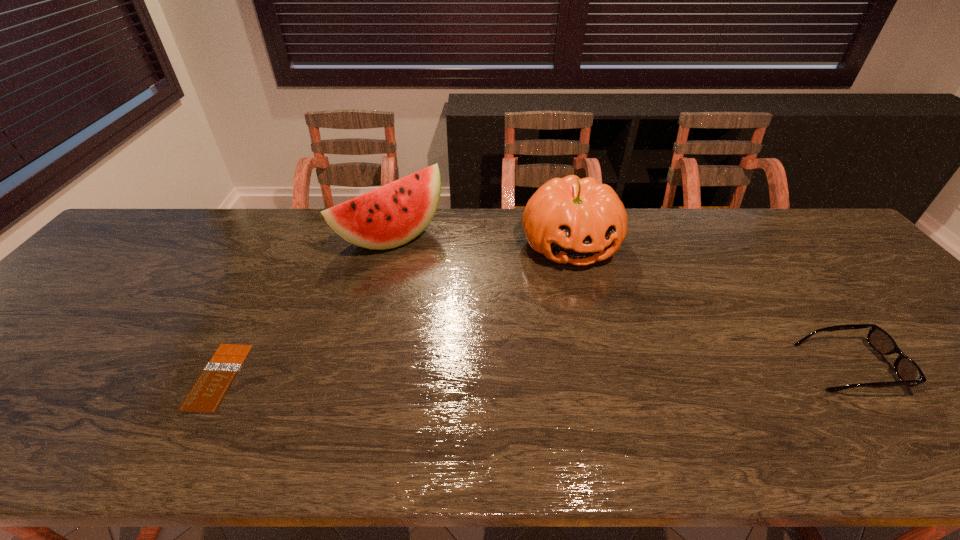
You are a GUI agent. You are given a task and a screenshot of the screen. Output one action in this format:
    pyautogui.click(x=<x>, y=<y>)
    Task: Click on the vacant space at the left edge of the desktop
    The width and height of the screenshot is (960, 540).
    Given the screenshot: What is the action you would take?
    17,338

In the image, there is a desktop. Where is `vacant space at the far left corner`? This screenshot has width=960, height=540. vacant space at the far left corner is located at coordinates (165, 224).

Locate an element on the screen. This screenshot has width=960, height=540. vacant space at the far right corner is located at coordinates (845, 244).

The image size is (960, 540). I want to click on blank region between the second object from right to left and the second shortest object, so 709,306.

This screenshot has height=540, width=960. Find the location of `free space between the pumpkin and the third object from right to left`. free space between the pumpkin and the third object from right to left is located at coordinates (481, 240).

What are the coordinates of `free space between the second object from left to right and the spectacles` in the screenshot? It's located at (620, 302).

This screenshot has width=960, height=540. What are the coordinates of `vacant space that is in between the pumpkin and the shortest object` in the screenshot? It's located at (395, 310).

Identify the location of free space between the leftmost object and the second object from right to left. (395, 310).

This screenshot has width=960, height=540. I want to click on empty space that is in between the pumpkin and the third tallest object, so click(709, 306).

Identify the location of free space between the pumpkin and the rightmost object. (709, 306).